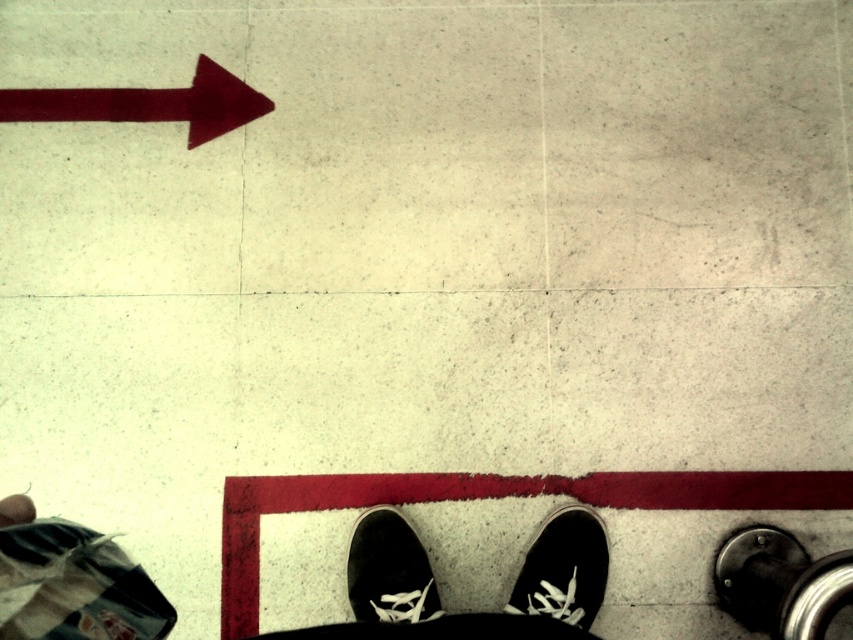
You are standing above the black canvas shoe at lower center. Where is the shoe located in relation to the red arrow painted on the floor?

The black canvas shoe at lower center is located at point (563, 568). Since the red arrow points to the left, the shoe is to the right of the arrow.

Based on the photo, you are standing in a room with a matte red arrow at upper left and a black canvas shoe at lower center. Which object is closer to you?

The matte red arrow at upper left is closer to you because it is further to the viewer than the black canvas shoe at lower center.